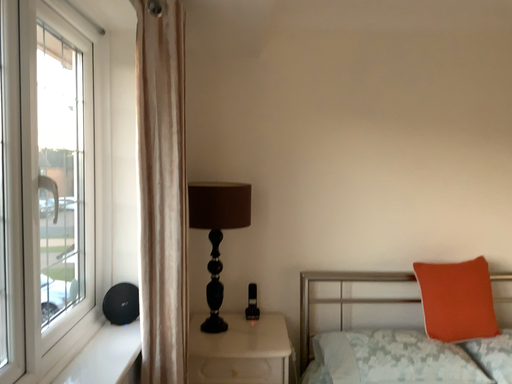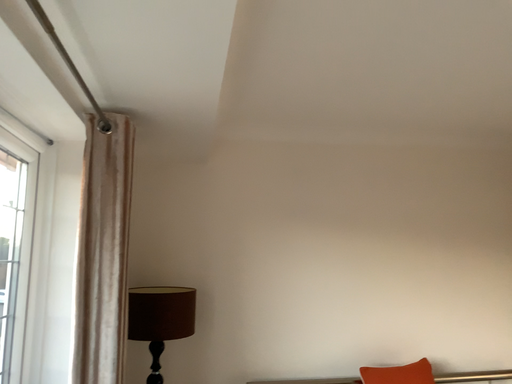
Question: How did the camera likely rotate when shooting the video?

Choices:
 (A) rotated left
 (B) rotated right

Answer: (B)